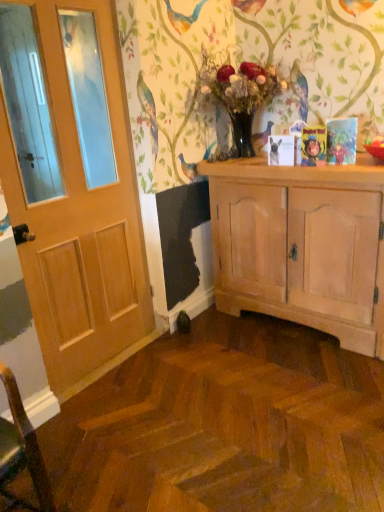
You are a GUI agent. You are given a task and a screenshot of the screen. Output one action in this format:
    pyautogui.click(x=<x>, y=<y>)
    Task: Click on the free space to the left of matte white dog at center
    
    Given the screenshot: What is the action you would take?
    pyautogui.click(x=256, y=168)